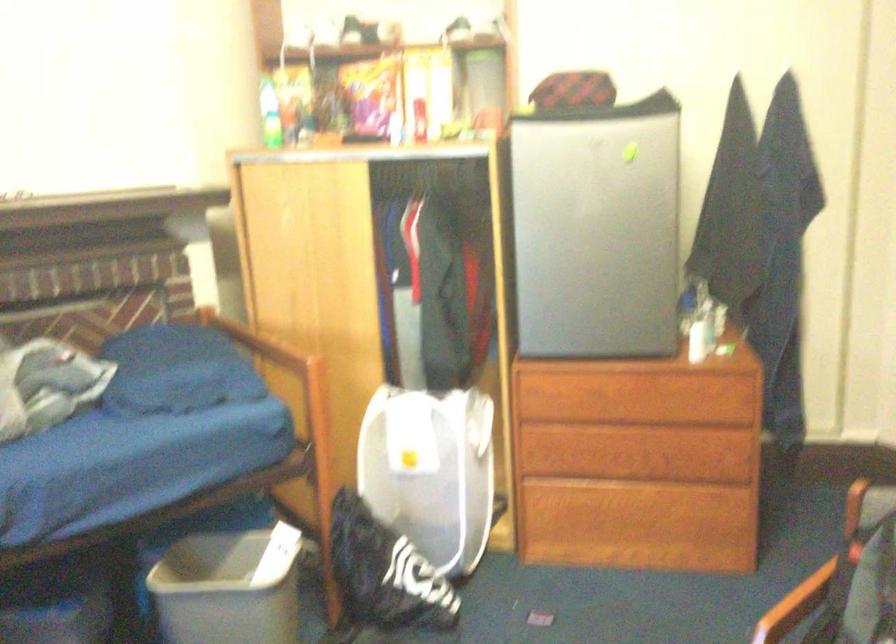
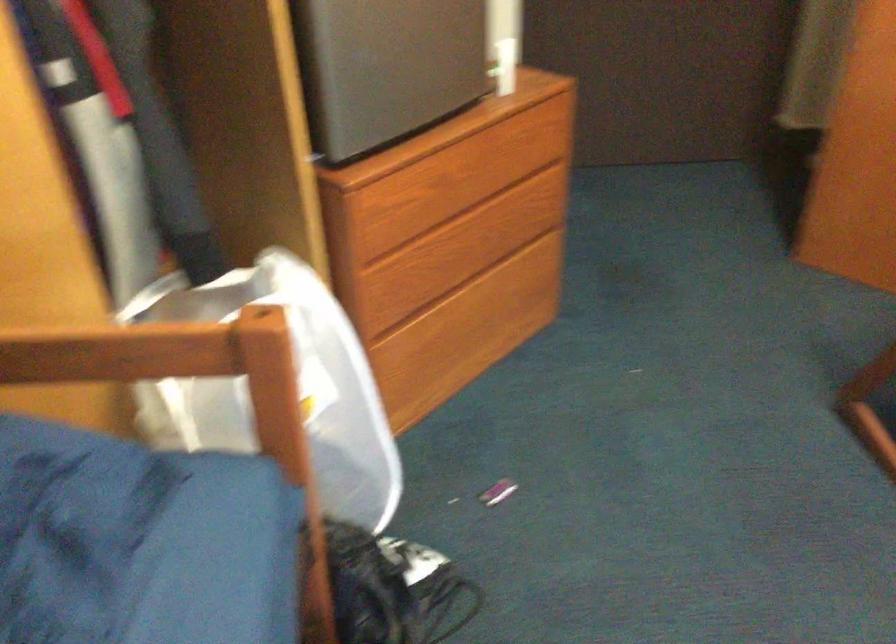
Where in the second image is the point corresponding to the point at 321,399 from the first image?

(297, 386)